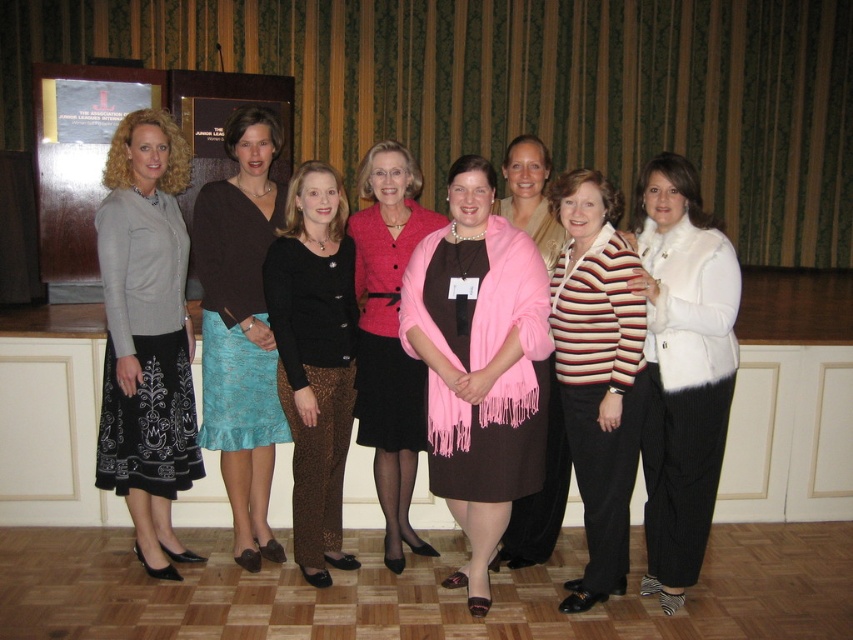
You are a photographer setting up for a group photo. You notice the pink fabric shawl at center and the teal satin skirt at center. Which one is shorter in height?

The pink fabric shawl at center is not as tall as the teal satin skirt at center, so the pink fabric shawl at center is shorter in height.

You are organizing a charity event and need to arrange seating for two guests wearing the matte black skirt at left and the black lace pants at center. The chairs available have a standard width of 45 cm. Based on their clothing, can both guests comfortably sit without their attire overlapping?

The matte black skirt at left might be wider than black lace pants at center. Since the skirt could be wider, it may require more space. However, without exact measurements, it is uncertain if both will fit comfortably in 45 cm chairs. Consider wider chairs or adjusting seating arrangements for comfort.